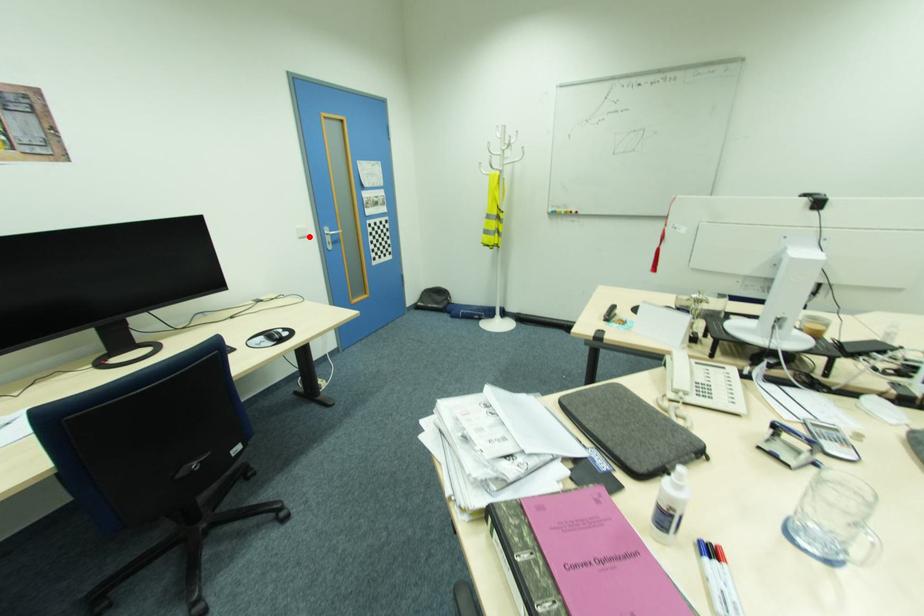
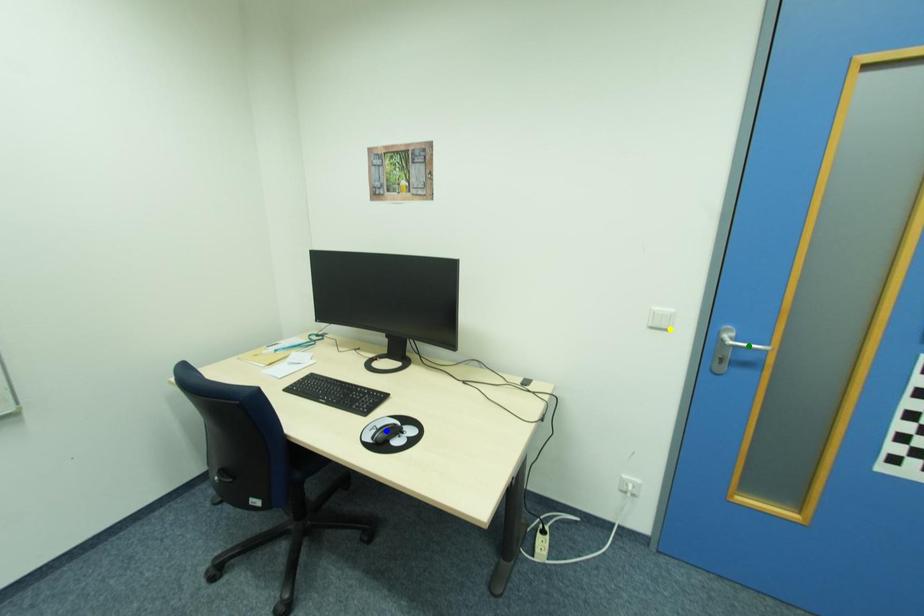
Question: I am providing you with two images of the same scene from different viewpoints. A red point is marked on the first image. You are given multiple points on the second image. Which mark in image 2 goes with the point in image 1?

Choices:
 (A) blue point
 (B) green point
 (C) yellow point

Answer: (C)